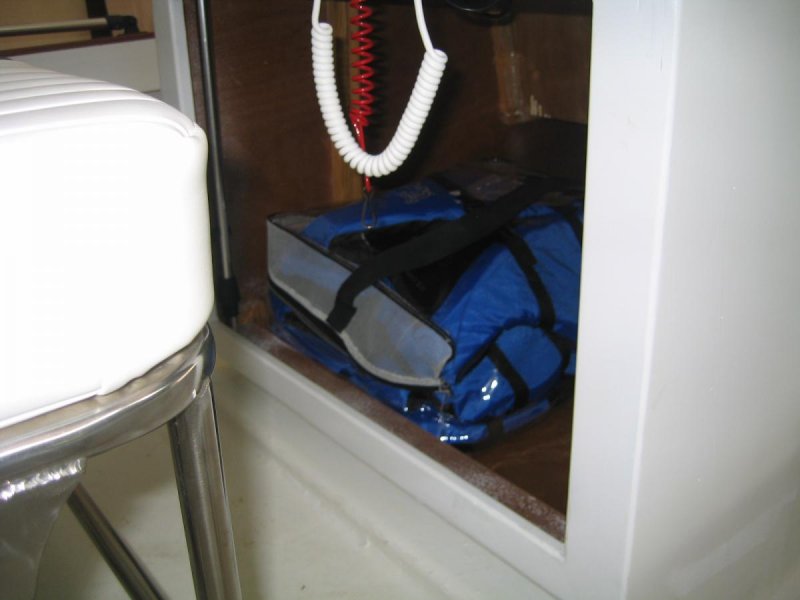
Image resolution: width=800 pixels, height=600 pixels. In order to click on table leg in this screenshot , I will do [208, 497].